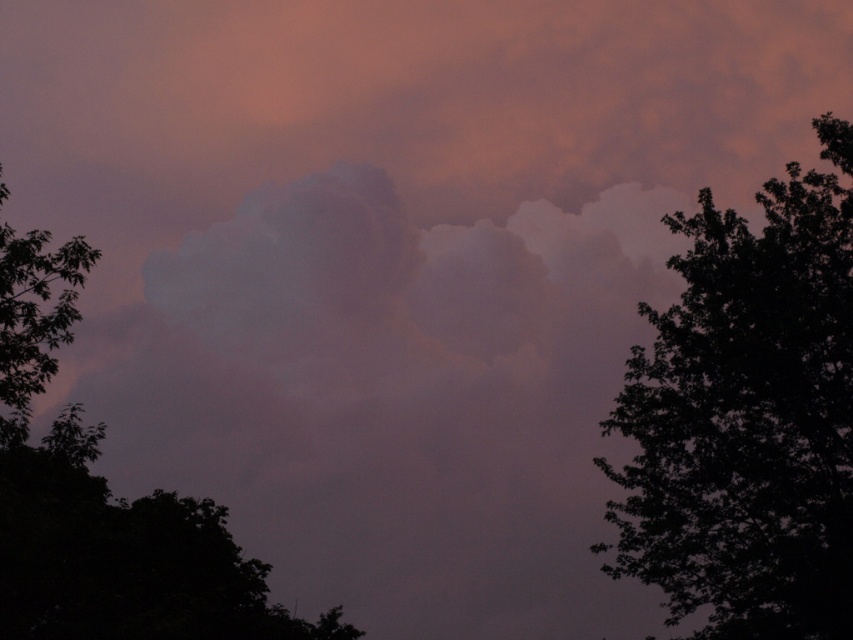
You are an observer standing in front of the image. Which tree, the silhouette leafy tree at right or the dark green leafy tree at left, is positioned lower in the scene?

The silhouette leafy tree at right is positioned lower than the dark green leafy tree at left in the scene.